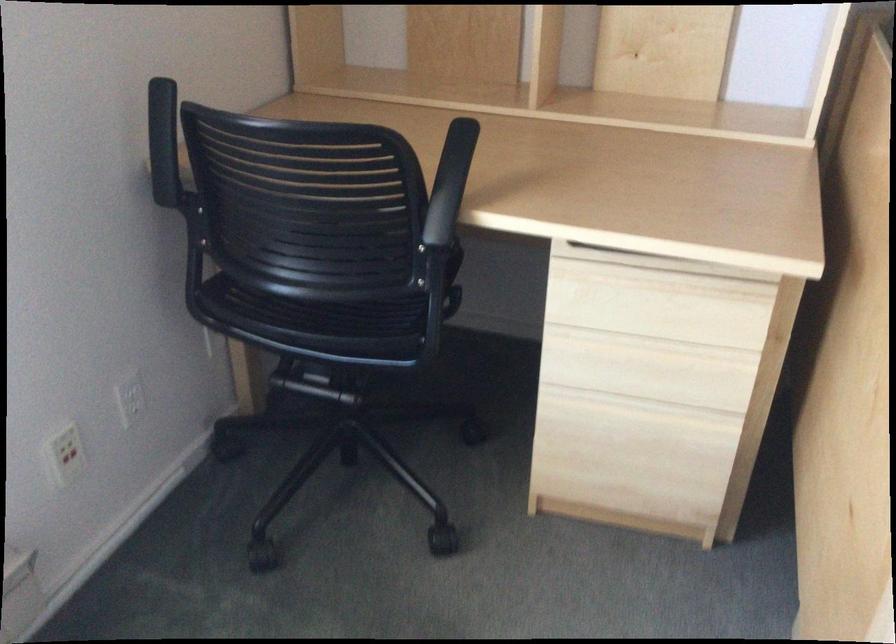
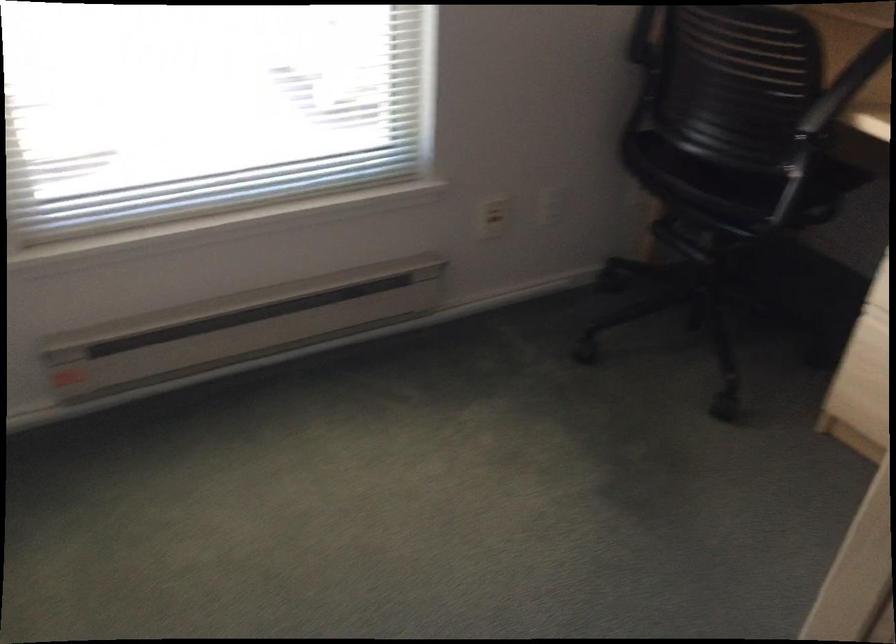
Question: How did the camera likely rotate?

Choices:
 (A) Left
 (B) Right
 (C) Up
 (D) Down

Answer: (A)